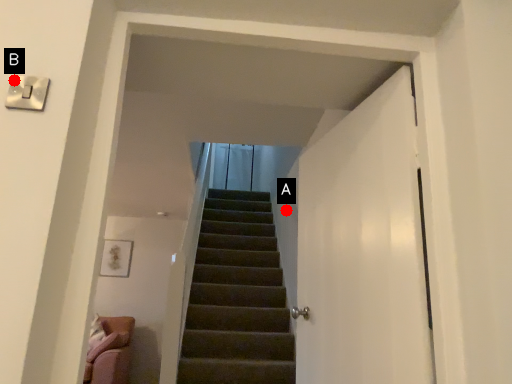
Question: Two points are circled on the image, labeled by A and B beside each circle. Which point is further to the camera?

Choices:
 (A) A is further
 (B) B is further

Answer: (A)